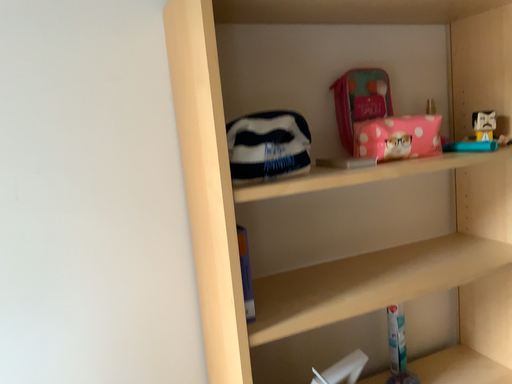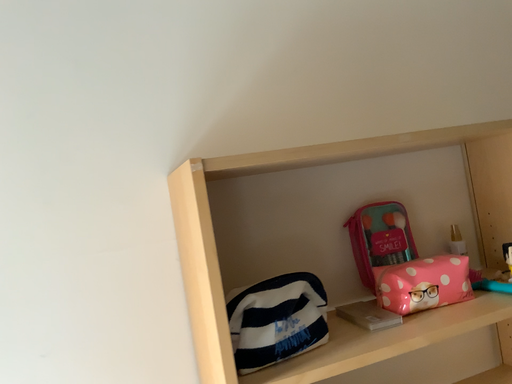
Question: Which way did the camera rotate in the video?

Choices:
 (A) rotated upward
 (B) rotated downward

Answer: (A)